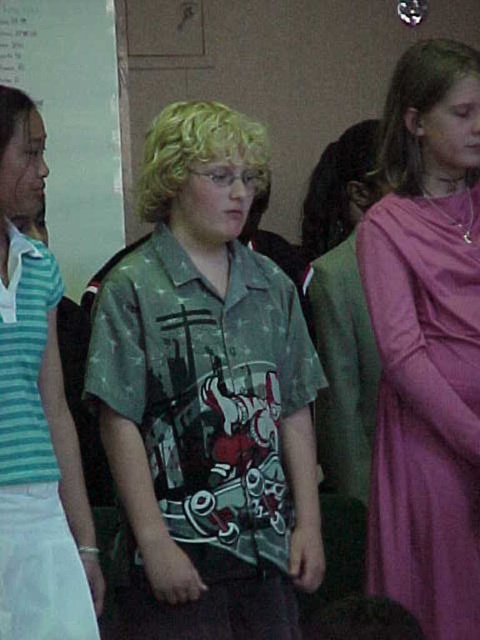
You are an interior designer analyzing the spatial layout of this image. The scene has a central figure wearing a green shirt, a person on the left in a striped shirt, and the purple satin dress at right. Based on their positions, which object is located closer to the bottom edge of the image?

The purple satin dress at right is located closer to the bottom edge of the image because its 2D coordinates are at point (x=425, y=406), where the y coordinate 0.887 is closer to 1.0, which represents the bottom edge.

You are a photographer trying to capture a group photo of the individuals in the scene. You notice two people with distinct hairstyles at the center of the image. Which of the two, the blonde curly hair at center or the dark brown hair at center, should you position to the right side of the frame to ensure proper alignment with the existing group?

The blonde curly hair at center is to the left of dark brown hair at center, so to align properly with the existing group, you should position the dark brown hair at center to the right side of the frame.